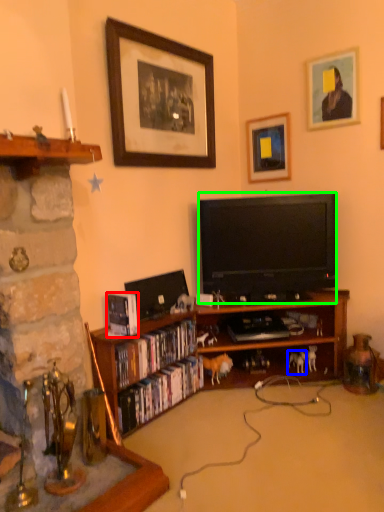
Question: Estimate the real-world distances between objects in this image. Which object is closer to book (highlighted by a red box), animal (highlighted by a blue box) or television (highlighted by a green box)?

Choices:
 (A) animal
 (B) television

Answer: (B)